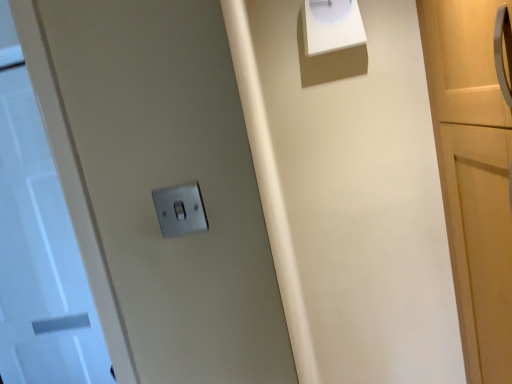
Question: Is the position of white glossy clock at upper center less distant than that of white glossy door at left?

Choices:
 (A) no
 (B) yes

Answer: (B)

Question: Can you confirm if white glossy clock at upper center is thinner than white glossy door at left?

Choices:
 (A) yes
 (B) no

Answer: (B)

Question: Is white glossy clock at upper center oriented away from white glossy door at left?

Choices:
 (A) no
 (B) yes

Answer: (A)

Question: Is white glossy clock at upper center further to the viewer compared to white glossy door at left?

Choices:
 (A) no
 (B) yes

Answer: (A)

Question: Considering the relative sizes of white glossy clock at upper center and white glossy door at left in the image provided, is white glossy clock at upper center wider than white glossy door at left?

Choices:
 (A) yes
 (B) no

Answer: (A)

Question: From the image's perspective, is white glossy door at left located above or below white glossy clock at upper center?

Choices:
 (A) above
 (B) below

Answer: (B)

Question: Considering the positions of white glossy door at left and white glossy clock at upper center in the image, is white glossy door at left bigger or smaller than white glossy clock at upper center?

Choices:
 (A) big
 (B) small

Answer: (A)

Question: Does point (17, 150) appear closer or farther from the camera than point (338, 44)?

Choices:
 (A) farther
 (B) closer

Answer: (A)

Question: From a real-world perspective, is white glossy door at left positioned above or below white glossy clock at upper center?

Choices:
 (A) below
 (B) above

Answer: (A)

Question: Visually, is white glossy door at left positioned to the left or to the right of metallic silver light switch at center?

Choices:
 (A) left
 (B) right

Answer: (A)

Question: Is white glossy door at left wider or thinner than metallic silver light switch at center?

Choices:
 (A) wide
 (B) thin

Answer: (A)

Question: Looking at the image, does white glossy door at left seem bigger or smaller compared to metallic silver light switch at center?

Choices:
 (A) small
 (B) big

Answer: (B)

Question: Is white glossy door at left inside the boundaries of metallic silver light switch at center, or outside?

Choices:
 (A) outside
 (B) inside

Answer: (A)

Question: Choose the correct answer: Is white glossy clock at upper center inside white glossy door at left or outside it?

Choices:
 (A) outside
 (B) inside

Answer: (A)

Question: In terms of width, does white glossy clock at upper center look wider or thinner when compared to white glossy door at left?

Choices:
 (A) wide
 (B) thin

Answer: (A)